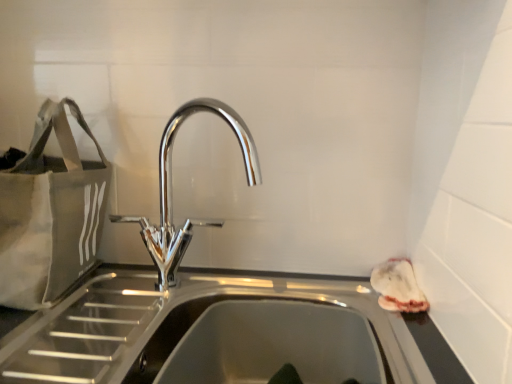
In order to face chrome metallic tap at center, should I rotate leftwards or rightwards?

To face it directly, rotate left by 7.050 degrees.

What are the coordinates of `chrome metallic tap at center` in the screenshot? It's located at (170, 190).

Describe the element at coordinates (170, 190) in the screenshot. I see `chrome metallic tap at center` at that location.

Measure the distance between matte gray tote at left and camera.

They are 26.36 inches apart.

What is the approximate height of matte gray tote at left?

It is 13.30 inches.

This screenshot has width=512, height=384. Identify the location of matte gray tote at left. (50, 213).

This screenshot has width=512, height=384. What do you see at coordinates (50, 213) in the screenshot?
I see `matte gray tote at left` at bounding box center [50, 213].

At what (x,y) coordinates should I click in order to perform the action: click on chrome metallic tap at center. Please return your answer as a coordinate pair (x, y). This screenshot has width=512, height=384. Looking at the image, I should click on (170, 190).

Can you confirm if matte gray tote at left is positioned to the left of chrome metallic tap at center?

Indeed, matte gray tote at left is positioned on the left side of chrome metallic tap at center.

Does matte gray tote at left lie behind chrome metallic tap at center?

Yes, matte gray tote at left is further from the camera.

Does point (50, 194) come farther from viewer compared to point (234, 133)?

No, (50, 194) is closer to viewer.

From the image's perspective, does matte gray tote at left appear higher than chrome metallic tap at center?

Yes, from the image's perspective, matte gray tote at left is above chrome metallic tap at center.

From a real-world perspective, does matte gray tote at left sit lower than chrome metallic tap at center?

No, from a real-world perspective, matte gray tote at left is not beneath chrome metallic tap at center.

Considering the relative sizes of matte gray tote at left and chrome metallic tap at center in the image provided, is matte gray tote at left thinner than chrome metallic tap at center?

Incorrect, the width of matte gray tote at left is not less than that of chrome metallic tap at center.

Based on the photo, between matte gray tote at left and chrome metallic tap at center, which one has less height?

With less height is chrome metallic tap at center.

Consider the image. Between matte gray tote at left and chrome metallic tap at center, which one has smaller size?

chrome metallic tap at center is smaller.

Is matte gray tote at left spatially inside chrome metallic tap at center, or outside of it?

matte gray tote at left is located beyond the bounds of chrome metallic tap at center.

Would you consider matte gray tote at left to be distant from chrome metallic tap at center?

No.

Could you tell me if matte gray tote at left is turned towards chrome metallic tap at center?

No, matte gray tote at left is not turned towards chrome metallic tap at center.

You are a GUI agent. You are given a task and a screenshot of the screen. Output one action in this format:
    pyautogui.click(x=<x>, y=<y>)
    Task: Click on the tap below the matte gray tote at left (from the image's perspective)
    
    Given the screenshot: What is the action you would take?
    pyautogui.click(x=170, y=190)

Considering the relative positions of chrome metallic tap at center and matte gray tote at left in the image provided, is chrome metallic tap at center to the right of matte gray tote at left from the viewer's perspective?

Indeed, chrome metallic tap at center is positioned on the right side of matte gray tote at left.

Who is more distant, chrome metallic tap at center or matte gray tote at left?

matte gray tote at left.

Is point (170, 215) farther from camera compared to point (79, 220)?

Yes, point (170, 215) is farther from viewer.

From the picture: From the image's perspective, between chrome metallic tap at center and matte gray tote at left, who is located below?

chrome metallic tap at center appears lower in the image.

From a real-world perspective, is chrome metallic tap at center below matte gray tote at left?

Yes, from a real-world perspective, chrome metallic tap at center is below matte gray tote at left.

Considering the relative sizes of chrome metallic tap at center and matte gray tote at left in the image provided, is chrome metallic tap at center thinner than matte gray tote at left?

Correct, the width of chrome metallic tap at center is less than that of matte gray tote at left.

Considering the relative sizes of chrome metallic tap at center and matte gray tote at left in the image provided, is chrome metallic tap at center taller than matte gray tote at left?

In fact, chrome metallic tap at center may be shorter than matte gray tote at left.

Who is smaller, chrome metallic tap at center or matte gray tote at left?

chrome metallic tap at center.

Is matte gray tote at left located within chrome metallic tap at center?

Actually, matte gray tote at left is outside chrome metallic tap at center.

Would you consider chrome metallic tap at center to be distant from matte gray tote at left?

No, chrome metallic tap at center is in close proximity to matte gray tote at left.

Is chrome metallic tap at center aimed at matte gray tote at left?

No, chrome metallic tap at center is not turned towards matte gray tote at left.

I want to click on bag located behind the chrome metallic tap at center, so click(x=50, y=213).

Image resolution: width=512 pixels, height=384 pixels. Identify the location of bag behind the chrome metallic tap at center. (50, 213).

In the image, there is a chrome metallic tap at center. What are the coordinates of `bag above it (from the image's perspective)` in the screenshot? It's located at (50, 213).